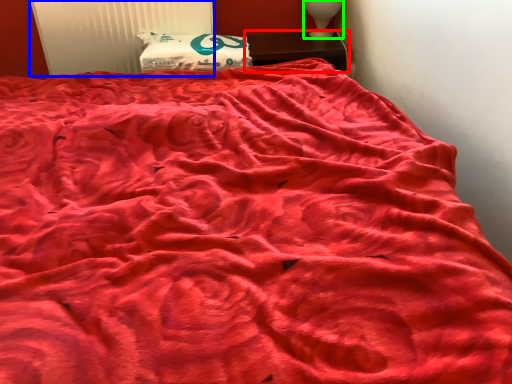
Question: Estimate the real-world distances between objects in this image. Which object is farther from furniture (highlighted by a red box), radiator (highlighted by a blue box) or table lamp (highlighted by a green box)?

Choices:
 (A) radiator
 (B) table lamp

Answer: (A)